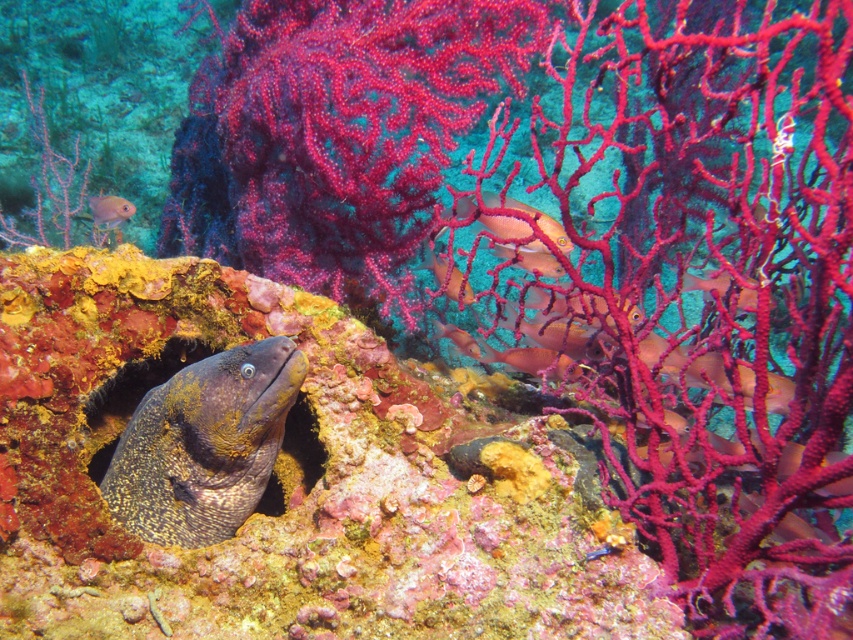
Between point (548, 266) and point (453, 326), which one is positioned in front?

Point (548, 266) is more forward.

Is smooth orange fish at center above shiny orange fish at center?

Yes, smooth orange fish at center is above shiny orange fish at center.

Is point (508, 250) more distant than point (473, 339)?

No, (508, 250) is closer to viewer.

Locate an element on the screen. This screenshot has width=853, height=640. smooth orange fish at center is located at coordinates (531, 260).

Between orange matte fish at upper right and speckled yellow-green moray eel at center, which one has less height?

With less height is speckled yellow-green moray eel at center.

What do you see at coordinates (700, 340) in the screenshot? I see `orange matte fish at upper right` at bounding box center [700, 340].

This screenshot has width=853, height=640. Identify the location of orange matte fish at upper right. (x=700, y=340).

Is orange matte fish at center below smooth orange fish at center?

Yes.

Is orange matte fish at center to the left of smooth orange fish at center from the viewer's perspective?

Yes, orange matte fish at center is to the left of smooth orange fish at center.

The image size is (853, 640). I want to click on orange matte fish at center, so click(x=447, y=276).

In order to click on orange matte fish at center in this screenshot , I will do `click(447, 276)`.